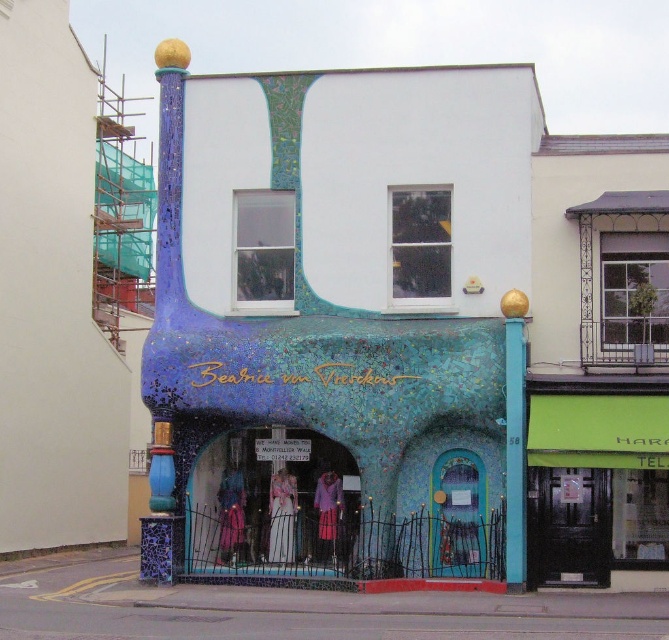
Question: Is green fabric awning at upper right thinner than teal mosaic door at lower center?

Choices:
 (A) yes
 (B) no

Answer: (B)

Question: Does green fabric awning at upper right have a lesser width compared to teal mosaic door at lower center?

Choices:
 (A) yes
 (B) no

Answer: (B)

Question: Which point is closer to the camera?

Choices:
 (A) (161, 509)
 (B) (624, 552)

Answer: (B)

Question: Where is green fabric awning at upper right located in relation to teal mosaic door at lower center in the image?

Choices:
 (A) above
 (B) below

Answer: (A)

Question: Among these points, which one is farthest from the camera?

Choices:
 (A) (666, 560)
 (B) (171, 468)

Answer: (B)